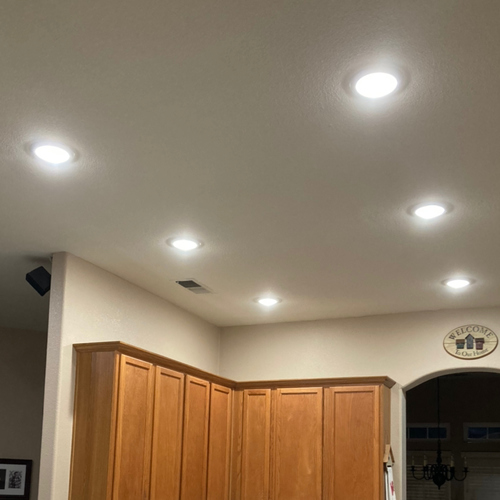
Find the location of a particular element. This screenshot has width=500, height=500. wall plaque is located at coordinates (466, 338).